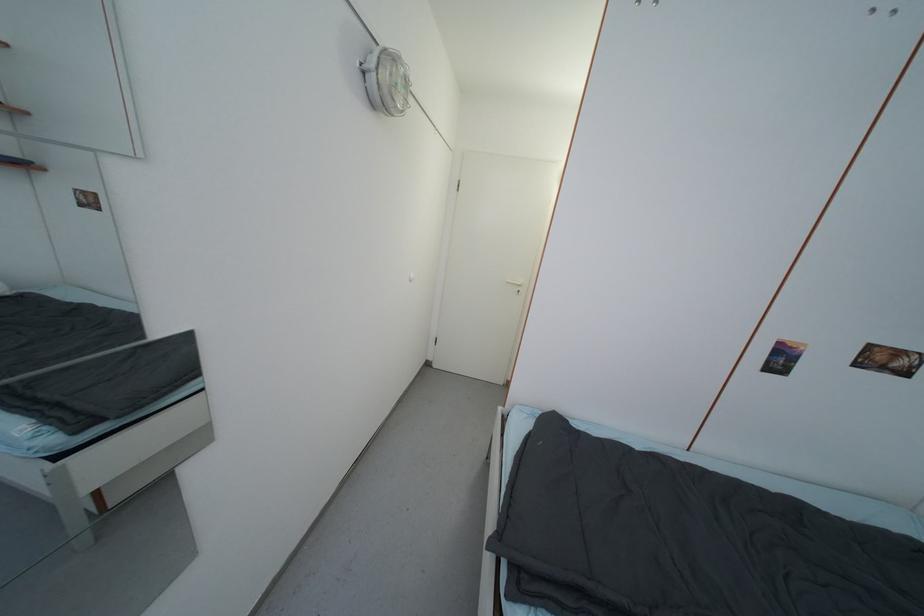
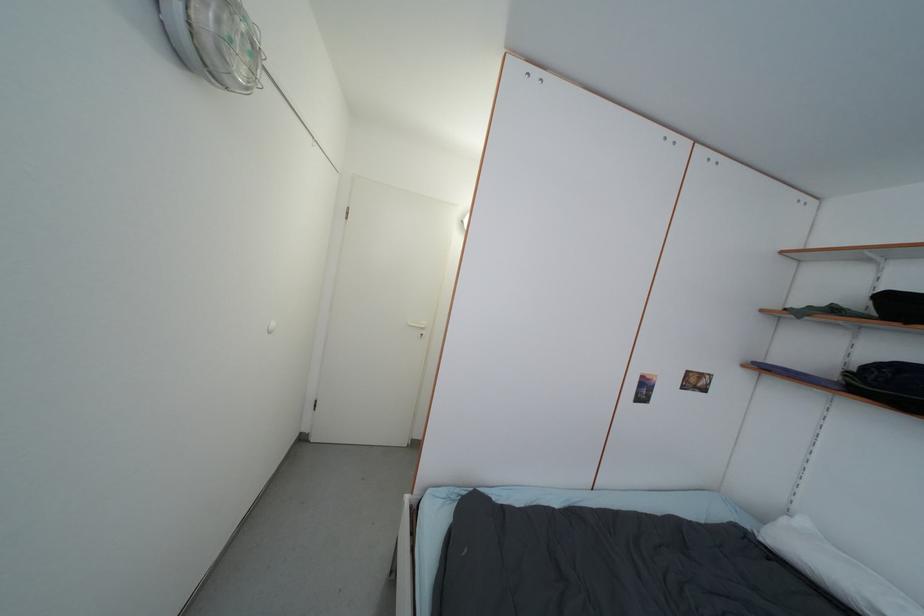
Question: What movement of the cameraman would produce the second image?

Choices:
 (A) Left
 (B) Right
 (C) Forward
 (D) Backward

Answer: (C)